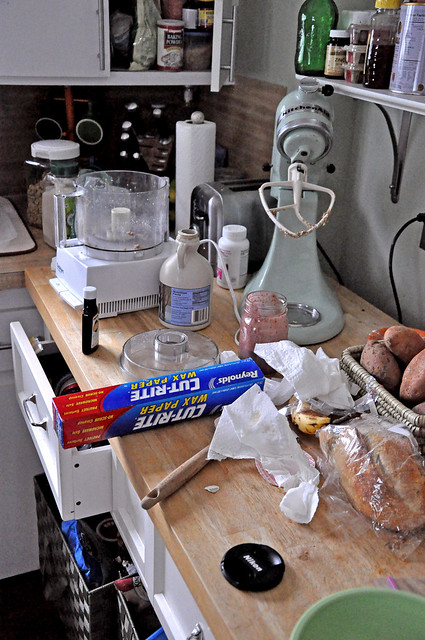
The height and width of the screenshot is (640, 425). In order to click on beige jug in this screenshot , I will do pos(196,273).